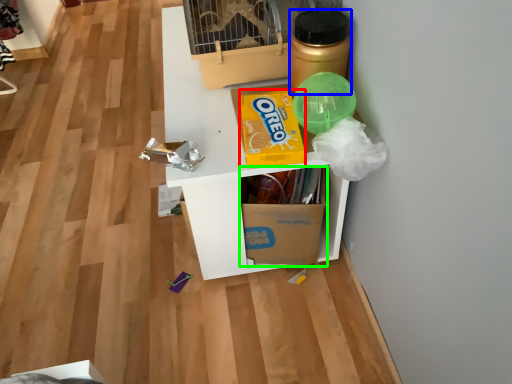
Question: Estimate the real-world distances between objects in this image. Which object is farther from cereal (highlighted by a red box), bottle (highlighted by a blue box) or cardboard box (highlighted by a green box)?

Choices:
 (A) bottle
 (B) cardboard box

Answer: (B)